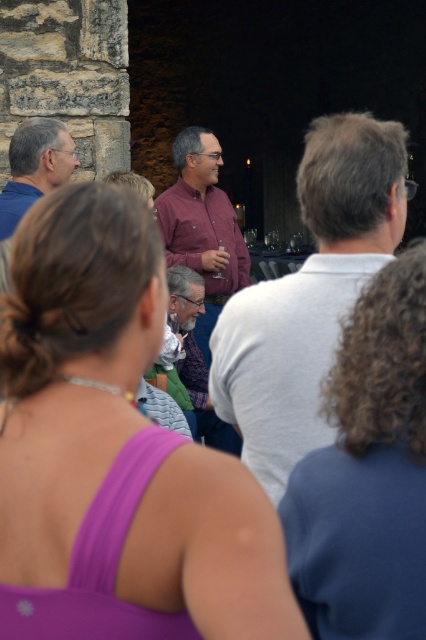
Question: Does matte pink shirt at center have a larger size compared to matte purple shirt at center?

Choices:
 (A) yes
 (B) no

Answer: (A)

Question: Which point appears farthest from the camera in this image?

Choices:
 (A) (28, 144)
 (B) (284, 397)
 (C) (204, 156)

Answer: (C)

Question: Is the position of purple fabric top at center less distant than that of matte gray shirt at left?

Choices:
 (A) yes
 (B) no

Answer: (A)

Question: Which object is farther from the camera taking this photo?

Choices:
 (A) matte purple shirt at center
 (B) purple fabric top at center
 (C) matte gray shirt at left

Answer: (A)

Question: Is curly hair at center thinner than matte pink shirt at center?

Choices:
 (A) yes
 (B) no

Answer: (A)

Question: Among these points, which one is nearest to the camera?

Choices:
 (A) (28, 344)
 (B) (196, 141)

Answer: (A)